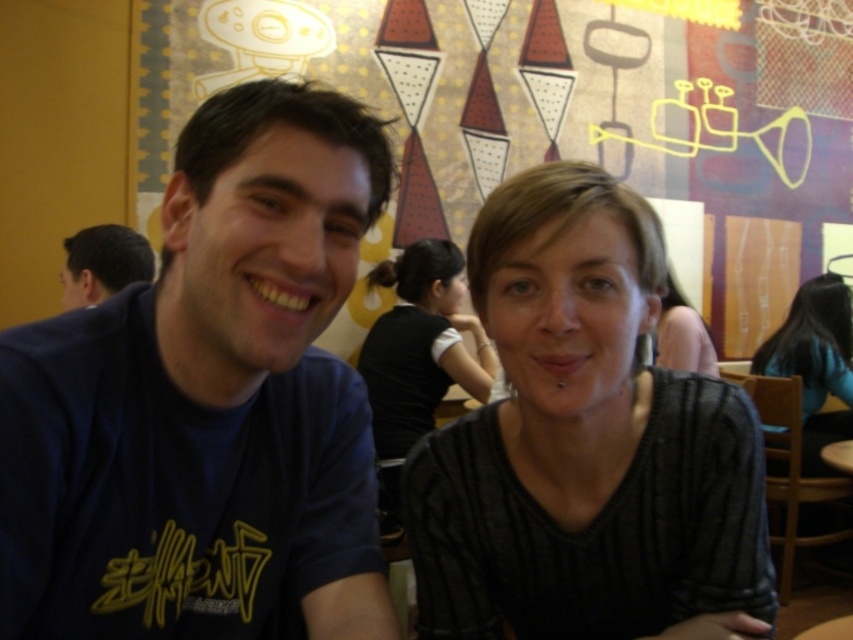
Question: Which point is closer to the camera taking this photo?

Choices:
 (A) (801, 445)
 (B) (682, 358)

Answer: (B)

Question: Is matte black sweater at center to the right of black fabric shirt at upper center from the viewer's perspective?

Choices:
 (A) no
 (B) yes

Answer: (A)

Question: Which of these objects is positioned closest to the black ribbed sweater at center?

Choices:
 (A) black fabric shirt at upper center
 (B) matte black sweater at center

Answer: (B)

Question: Can you confirm if black ribbed sweater at center is positioned below matte black sweater at center?

Choices:
 (A) yes
 (B) no

Answer: (B)

Question: Can you confirm if black fabric shirt at upper center is positioned below matte black shirt at center?

Choices:
 (A) yes
 (B) no

Answer: (A)

Question: Estimate the real-world distances between objects in this image. Which object is closer to the matte black sweater at center?

Choices:
 (A) matte black shirt at center
 (B) matte blue shirt at left

Answer: (A)